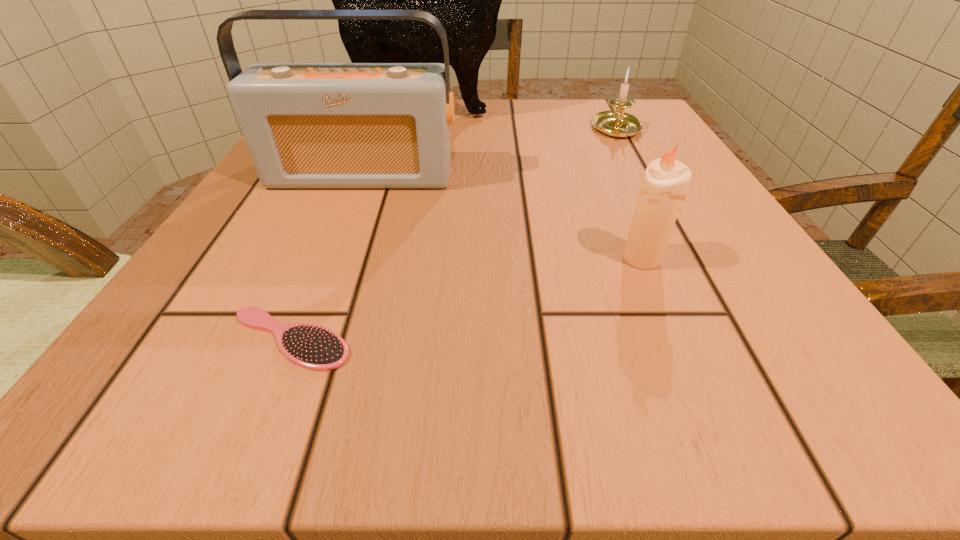
Where is `free space in the image that satisfies the following two spatial constraints: 1. on the front-facing side of the fourth shortest object; 2. on the left side of the second nearest object`? free space in the image that satisfies the following two spatial constraints: 1. on the front-facing side of the fourth shortest object; 2. on the left side of the second nearest object is located at coordinates (328, 259).

Identify the location of free space in the image that satisfies the following two spatial constraints: 1. on the face of the tallest object; 2. on the front-facing side of the second tallest object. Image resolution: width=960 pixels, height=540 pixels. (404, 176).

Where is `vacant region that satisfies the following two spatial constraints: 1. on the front-facing side of the fourth farthest object; 2. on the right side of the third nearest object`? Image resolution: width=960 pixels, height=540 pixels. vacant region that satisfies the following two spatial constraints: 1. on the front-facing side of the fourth farthest object; 2. on the right side of the third nearest object is located at coordinates (328, 259).

Find the location of a particular element. This screenshot has height=540, width=960. vacant space that satisfies the following two spatial constraints: 1. on the front-facing side of the radio receiver; 2. on the left side of the candle is located at coordinates (328, 259).

Image resolution: width=960 pixels, height=540 pixels. Find the location of `free space in the image that satisfies the following two spatial constraints: 1. on the back side of the third tallest object; 2. on the left side of the nearest object`. free space in the image that satisfies the following two spatial constraints: 1. on the back side of the third tallest object; 2. on the left side of the nearest object is located at coordinates (323, 259).